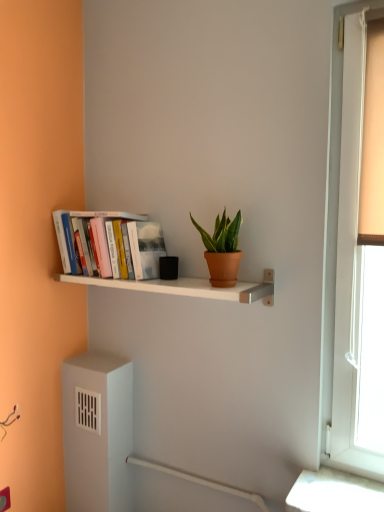
Question: Is terracotta clay pot at center placed right next to hardcover books at left?

Choices:
 (A) no
 (B) yes

Answer: (A)

Question: Is terracotta clay pot at center oriented away from hardcover books at left?

Choices:
 (A) no
 (B) yes

Answer: (A)

Question: Is terracotta clay pot at center aimed at hardcover books at left?

Choices:
 (A) yes
 (B) no

Answer: (B)

Question: Considering the relative sizes of terracotta clay pot at center and hardcover books at left in the image provided, is terracotta clay pot at center shorter than hardcover books at left?

Choices:
 (A) no
 (B) yes

Answer: (B)

Question: From a real-world perspective, is terracotta clay pot at center beneath hardcover books at left?

Choices:
 (A) no
 (B) yes

Answer: (B)

Question: Is point (114, 233) positioned closer to the camera than point (183, 288)?

Choices:
 (A) closer
 (B) farther

Answer: (B)

Question: Is hardcover books at left taller or shorter than white matte shelf at center?

Choices:
 (A) tall
 (B) short

Answer: (A)

Question: Is hardcover books at left bigger or smaller than white matte shelf at center?

Choices:
 (A) big
 (B) small

Answer: (A)

Question: From the image's perspective, relative to white matte shelf at center, is hardcover books at left above or below?

Choices:
 (A) above
 (B) below

Answer: (A)

Question: Does point pos(145,260) appear closer or farther from the camera than point pos(210,240)?

Choices:
 (A) farther
 (B) closer

Answer: (A)

Question: From a real-world perspective, is hardcover books at left above or below terracotta clay pot at center?

Choices:
 (A) below
 (B) above

Answer: (B)

Question: Looking at their shapes, would you say hardcover books at left is wider or thinner than terracotta clay pot at center?

Choices:
 (A) wide
 (B) thin

Answer: (A)

Question: Considering the positions of hardcover books at left and terracotta clay pot at center in the image, is hardcover books at left taller or shorter than terracotta clay pot at center?

Choices:
 (A) short
 (B) tall

Answer: (B)

Question: From the image's perspective, is terracotta clay pot at center above or below white matte shelf at center?

Choices:
 (A) below
 (B) above

Answer: (B)

Question: Visually, is terracotta clay pot at center positioned to the left or to the right of white matte shelf at center?

Choices:
 (A) left
 (B) right

Answer: (B)